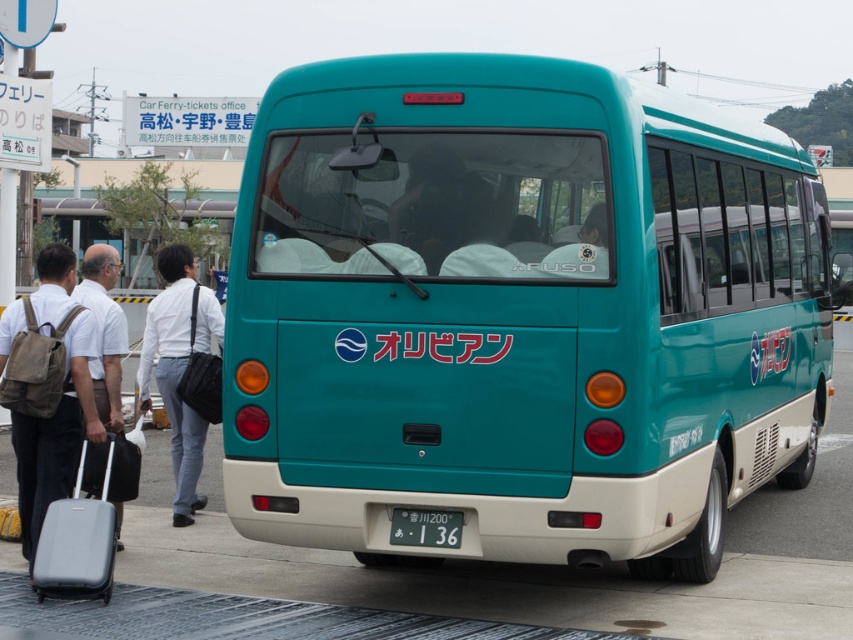
Question: Does white smooth shirt at left have a lesser width compared to white fabric shirt at left?

Choices:
 (A) no
 (B) yes

Answer: (A)

Question: Which of the following is the closest to the observer?

Choices:
 (A) teal matte windshield at center
 (B) matte gray suitcase at lower left

Answer: (A)

Question: Is teal matte windshield at center thinner than matte gray suitcase at lower left?

Choices:
 (A) no
 (B) yes

Answer: (A)

Question: Which object appears farthest from the camera in this image?

Choices:
 (A) brown canvas backpack at left
 (B) teal matte bus at center
 (C) white fabric shirt at left

Answer: (C)

Question: Is matte gray suitcase at lower left behind white plastic license plate at center?

Choices:
 (A) yes
 (B) no

Answer: (A)

Question: Which object is positioned closest to the teal matte bus at center?

Choices:
 (A) matte gray suitcase at lower left
 (B) white fabric shirt at left
 (C) white plastic license plate at center

Answer: (C)